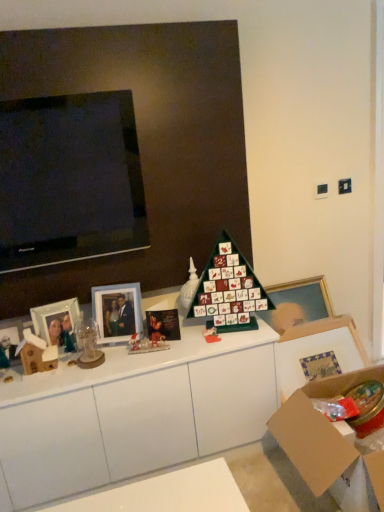
You are a GUI agent. You are given a task and a screenshot of the screen. Output one action in this format:
    pyautogui.click(x=<x>, y=<y>)
    Task: Click on the free spot in front of wooden house at left
    Image resolution: width=384 pixels, height=512 pixels.
    Given the screenshot: What is the action you would take?
    pyautogui.click(x=32, y=386)